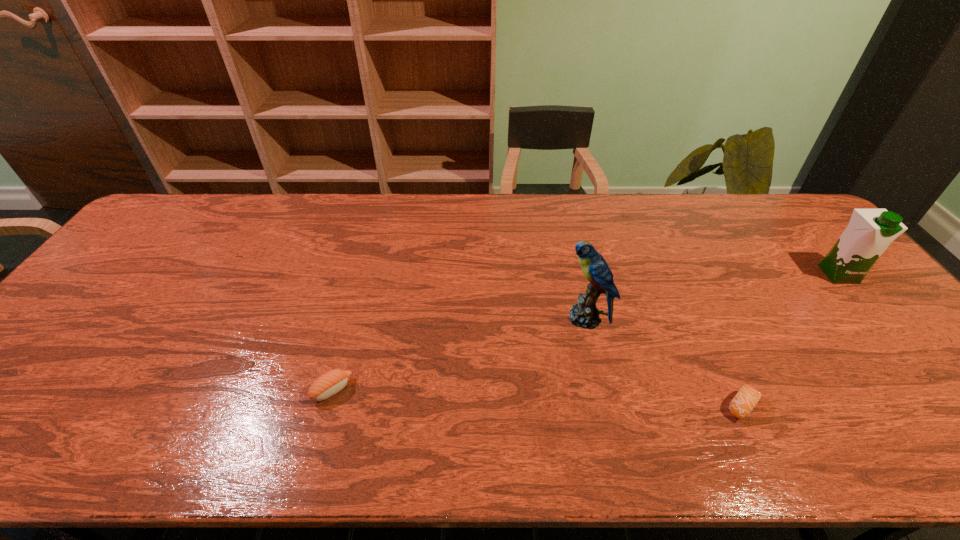
Where is `parrot`? Image resolution: width=960 pixels, height=540 pixels. parrot is located at coordinates (585, 314).

Find the location of a particular element. the second object from left to right is located at coordinates (585, 314).

The width and height of the screenshot is (960, 540). What are the coordinates of `soya milk` in the screenshot? It's located at (869, 233).

Locate an element on the screen. The width and height of the screenshot is (960, 540). the rightmost object is located at coordinates (869, 233).

Image resolution: width=960 pixels, height=540 pixels. Find the location of `the third tallest object`. the third tallest object is located at coordinates (331, 382).

Where is `the leftmost object`? the leftmost object is located at coordinates (331, 382).

The height and width of the screenshot is (540, 960). Identify the location of the right sushi. (747, 397).

Where is `the third object from left to right`? the third object from left to right is located at coordinates (747, 397).

Find the location of a particular element. The width and height of the screenshot is (960, 540). vacant area situated on the face of the parrot is located at coordinates (416, 318).

Where is `vacant space situated 0.230m on the face of the parrot`? This screenshot has height=540, width=960. vacant space situated 0.230m on the face of the parrot is located at coordinates (476, 318).